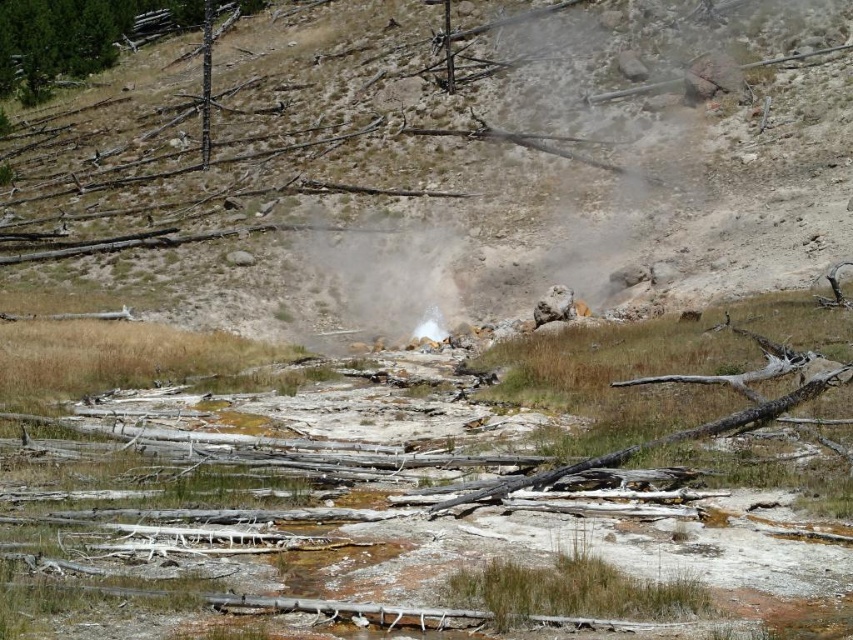
You are standing in the rugged landscape and want to take a photo of the brown dirt hillside at center and the green textured pine tree at upper left. Which object will appear larger in the photo?

The brown dirt hillside at center will appear larger in the photo because it is closer to you than the green textured pine tree at upper left.

You are a hiker trying to navigate through the rugged landscape. You see the white vapor at center and the green textured pine tree at upper left. Which object is positioned to the right of the other?

The white vapor at center is to the right of green textured pine tree at upper left.

You are a geologist examining the landscape. You notice the brown dirt hillside at center and the white vapor at center. Which of these two features is wider?

The brown dirt hillside at center is wider than the white vapor at center.